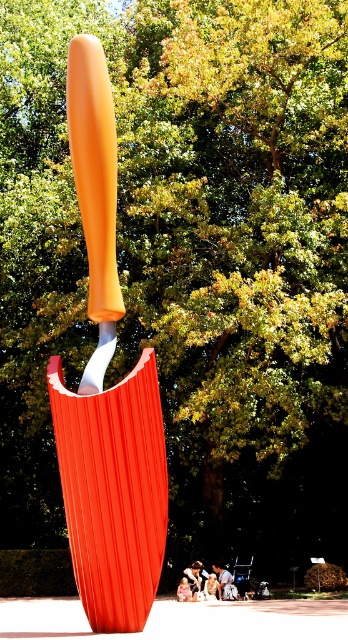
Question: Can you confirm if smooth beige shirt at center is positioned above smooth white shirt at center?

Choices:
 (A) no
 (B) yes

Answer: (A)

Question: Which point is farther to the camera?

Choices:
 (A) orange matte knife at center
 (B) white fabric person at center

Answer: (B)

Question: Which object appears closest to the camera in this image?

Choices:
 (A) white fabric person at center
 (B) orange matte shovel at center
 (C) smooth white shirt at center

Answer: (B)

Question: Is white fabric person at center bigger than smooth white shirt at center?

Choices:
 (A) no
 (B) yes

Answer: (B)

Question: Can you confirm if orange matte knife at center is positioned to the right of white fabric person at center?

Choices:
 (A) yes
 (B) no

Answer: (B)

Question: Which point is closer to the camera?

Choices:
 (A) (199, 568)
 (B) (216, 572)
 (C) (81, 84)

Answer: (C)